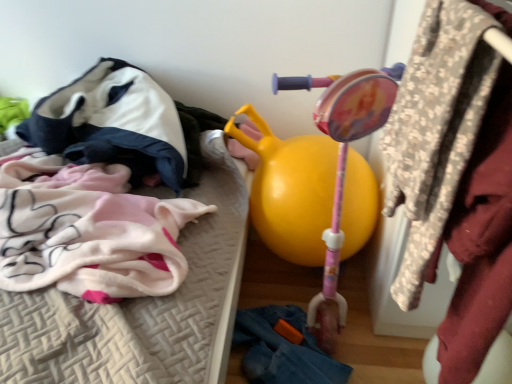
Question: In the image, is velvet-like hoodie at upper left, the 2th clothing from the bottom, on the left side or the right side of floral fabric coat at upper right?

Choices:
 (A) left
 (B) right

Answer: (A)

Question: Is velvet-like hoodie at upper left, which appears as the 1th clothing when viewed from the top, situated inside floral fabric coat at upper right or outside?

Choices:
 (A) outside
 (B) inside

Answer: (A)

Question: Based on their relative distances, which object is nearer to the yellow rubber ball at center?

Choices:
 (A) floral fabric coat at upper right
 (B) denim at lower right, arranged as the first clothing when viewed from the right
 (C) velvet-like hoodie at upper left, the first clothing viewed from the left
 (D) soft pink fabric blanket at left

Answer: (D)

Question: Which of these objects is positioned farthest from the floral fabric coat at upper right?

Choices:
 (A) velvet-like hoodie at upper left, arranged as the second clothing when viewed from the right
 (B) soft pink fabric blanket at left
 (C) denim at lower right, placed as the 1th clothing when sorted from bottom to top
 (D) yellow rubber ball at center

Answer: (A)